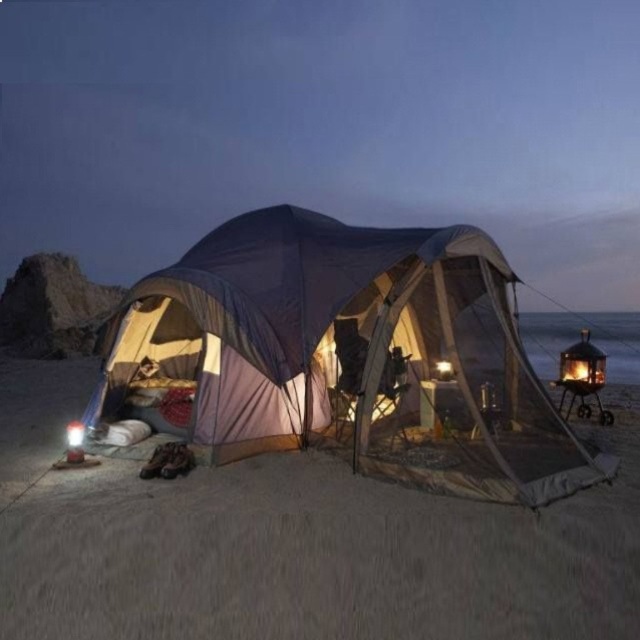
Where is `sandy beige sand at lower center`? This screenshot has width=640, height=640. sandy beige sand at lower center is located at coordinates (292, 545).